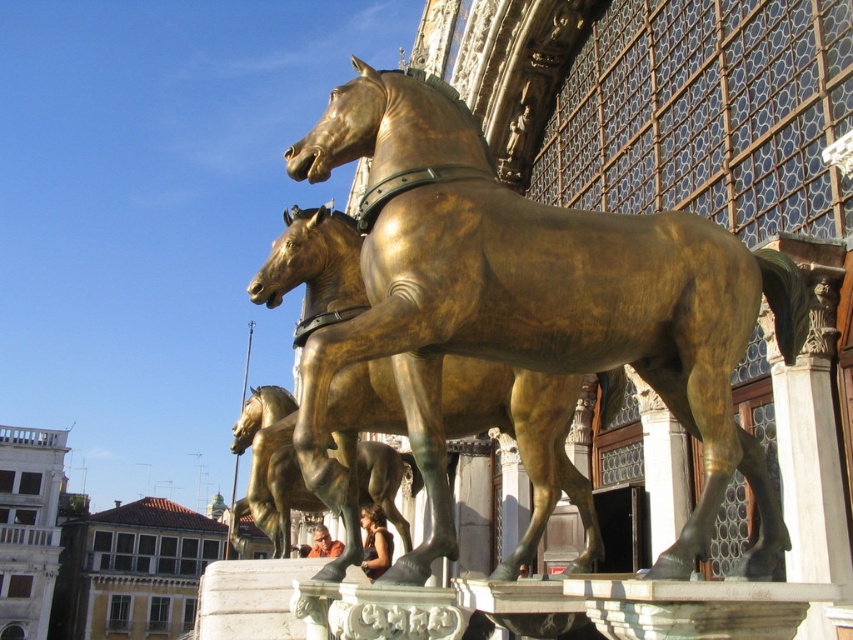
You are standing in the public square where the bronze sculpture of two horses is displayed. You want to take a photo of the sculpture from a distance that is exactly 37 meters away. According to the scene description, is there a specific location marked by a point at coordinates point (338,305) where you can stand to achieve this distance?

Yes, the point at coordinates point (338,305) is exactly 37.04 meters away from the viewer, so standing there would allow you to take the photo from the desired distance.

You are standing in front of the sculpture of two horses. Which horse, the gold polished bronze horse at center or the golden polished horse at center, is positioned closer to you?

The gold polished bronze horse at center is closer to the viewer than the golden polished horse at center.